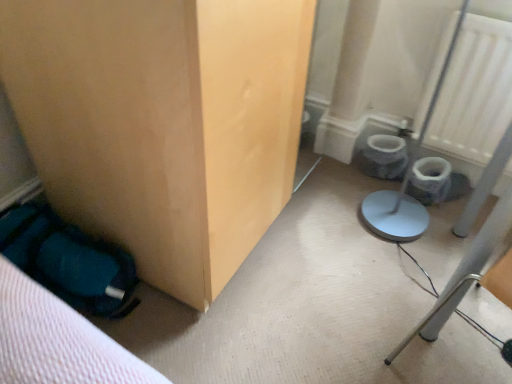
This screenshot has width=512, height=384. I want to click on white textured radiator at upper right, so click(474, 94).

Image resolution: width=512 pixels, height=384 pixels. Describe the element at coordinates (474, 94) in the screenshot. I see `white textured radiator at upper right` at that location.

This screenshot has height=384, width=512. Describe the element at coordinates (163, 123) in the screenshot. I see `matte wood cabinet at lower left` at that location.

At what (x,y) coordinates should I click in order to perform the action: click on matte wood cabinet at lower left. Please return your answer as a coordinate pair (x, y). This screenshot has width=512, height=384. Looking at the image, I should click on (163, 123).

Locate an element on the screen. white textured radiator at upper right is located at coordinates (474, 94).

Is matte wood cabinet at lower left to the left or to the right of white textured radiator at upper right in the image?

Based on their positions, matte wood cabinet at lower left is located to the left of white textured radiator at upper right.

Is matte wood cabinet at lower left behind white textured radiator at upper right?

No, it is not.

Which point is more forward, (298,85) or (488,107)?

Point (298,85)

From the image's perspective, is matte wood cabinet at lower left positioned above or below white textured radiator at upper right?

Based on their image positions, matte wood cabinet at lower left is located beneath white textured radiator at upper right.

From a real-world perspective, is matte wood cabinet at lower left on top of white textured radiator at upper right?

Yes, from a real-world perspective, matte wood cabinet at lower left is over white textured radiator at upper right

Is matte wood cabinet at lower left thinner than white textured radiator at upper right?

No, matte wood cabinet at lower left is not thinner than white textured radiator at upper right.

Considering the sizes of objects matte wood cabinet at lower left and white textured radiator at upper right in the image provided, who is taller, matte wood cabinet at lower left or white textured radiator at upper right?

With more height is matte wood cabinet at lower left.

Does matte wood cabinet at lower left have a smaller size compared to white textured radiator at upper right?

Actually, matte wood cabinet at lower left might be larger than white textured radiator at upper right.

Is matte wood cabinet at lower left inside the boundaries of white textured radiator at upper right, or outside?

matte wood cabinet at lower left is located beyond the bounds of white textured radiator at upper right.

Can you see matte wood cabinet at lower left touching white textured radiator at upper right?

There is a gap between matte wood cabinet at lower left and white textured radiator at upper right.

In the scene shown: Is matte wood cabinet at lower left oriented towards white textured radiator at upper right?

Yes, matte wood cabinet at lower left faces towards white textured radiator at upper right.

Measure the distance between matte wood cabinet at lower left and white textured radiator at upper right.

95.92 centimeters.

Where is `radiator behind the matte wood cabinet at lower left`? The height and width of the screenshot is (384, 512). radiator behind the matte wood cabinet at lower left is located at coordinates point(474,94).

Considering the positions of objects white textured radiator at upper right and matte wood cabinet at lower left in the image provided, who is more to the right, white textured radiator at upper right or matte wood cabinet at lower left?

white textured radiator at upper right is more to the right.

Relative to matte wood cabinet at lower left, is white textured radiator at upper right in front or behind?

Clearly, white textured radiator at upper right is behind matte wood cabinet at lower left.

Does point (467, 146) appear closer or farther from the camera than point (55, 160)?

Clearly, point (467, 146) is more distant from the camera than point (55, 160).

From the image's perspective, between white textured radiator at upper right and matte wood cabinet at lower left, who is located below?

matte wood cabinet at lower left.

From a real-world perspective, relative to matte wood cabinet at lower left, is white textured radiator at upper right vertically above or below?

white textured radiator at upper right is situated lower than matte wood cabinet at lower left in the real world.

Is white textured radiator at upper right wider than matte wood cabinet at lower left?

No.

Does white textured radiator at upper right have a lesser height compared to matte wood cabinet at lower left?

Indeed, white textured radiator at upper right has a lesser height compared to matte wood cabinet at lower left.

Is white textured radiator at upper right bigger than matte wood cabinet at lower left?

Actually, white textured radiator at upper right might be smaller than matte wood cabinet at lower left.

Based on the photo, is white textured radiator at upper right spatially inside matte wood cabinet at lower left, or outside of it?

white textured radiator at upper right is spatially situated outside matte wood cabinet at lower left.

Are white textured radiator at upper right and matte wood cabinet at lower left far apart?

No.

Consider the image. Is white textured radiator at upper right turned away from matte wood cabinet at lower left?

white textured radiator at upper right is not turned away from matte wood cabinet at lower left.

Can you tell me how much white textured radiator at upper right and matte wood cabinet at lower left differ in facing direction?

179 degrees.

The height and width of the screenshot is (384, 512). What are the coordinates of `radiator directly beneath the matte wood cabinet at lower left (from a real-world perspective)` in the screenshot? It's located at (474, 94).

This screenshot has height=384, width=512. Find the location of `radiator above the matte wood cabinet at lower left (from the image's perspective)`. radiator above the matte wood cabinet at lower left (from the image's perspective) is located at coordinates (474, 94).

Where is `radiator on the right of matte wood cabinet at lower left`? The image size is (512, 384). radiator on the right of matte wood cabinet at lower left is located at coordinates (474, 94).